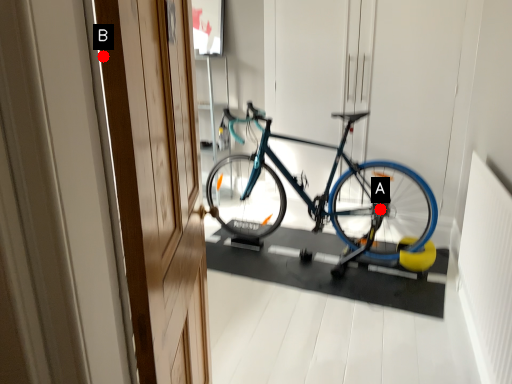
Question: Two points are circled on the image, labeled by A and B beside each circle. Which point is closer to the camera?

Choices:
 (A) A is closer
 (B) B is closer

Answer: (B)